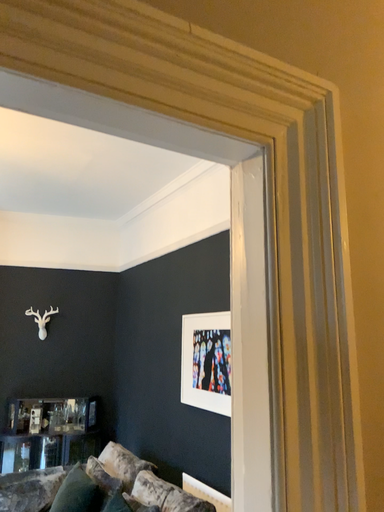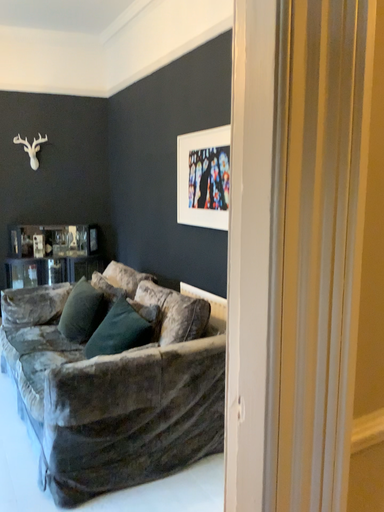
Question: How did the camera likely rotate when shooting the video?

Choices:
 (A) rotated downward
 (B) rotated upward

Answer: (A)